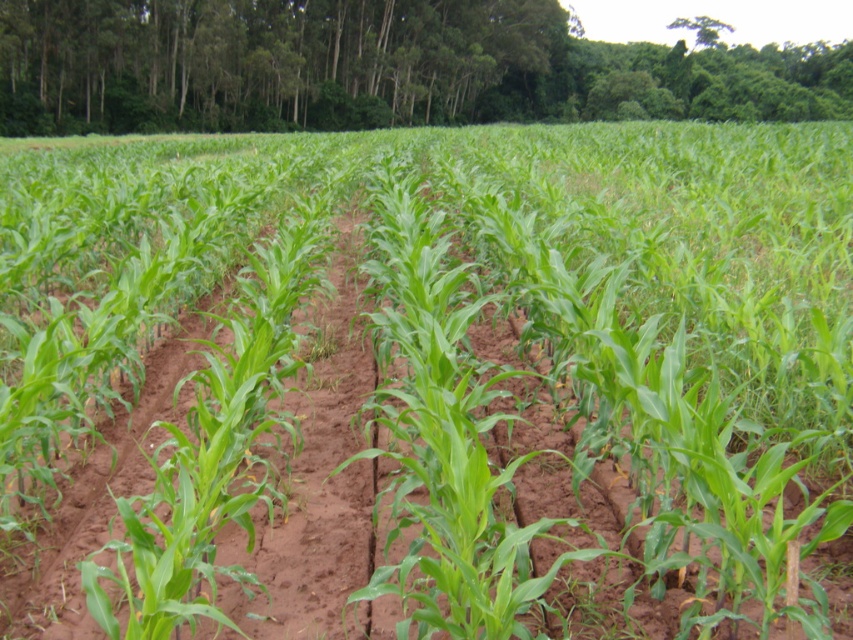
Based on the photo, who is more distant from viewer, (x=223, y=122) or (x=704, y=19)?

Point (x=704, y=19)

Between green leafy trees at upper center and green leafy tree at upper center, which one has less height?

Standing shorter between the two is green leafy tree at upper center.

Between point (558, 33) and point (721, 29), which one is positioned in front?

Point (558, 33) is more forward.

At what (x,y) coordinates should I click in order to perform the action: click on green leafy trees at upper center. Please return your answer as a coordinate pair (x, y). This screenshot has width=853, height=640. Looking at the image, I should click on (267, 61).